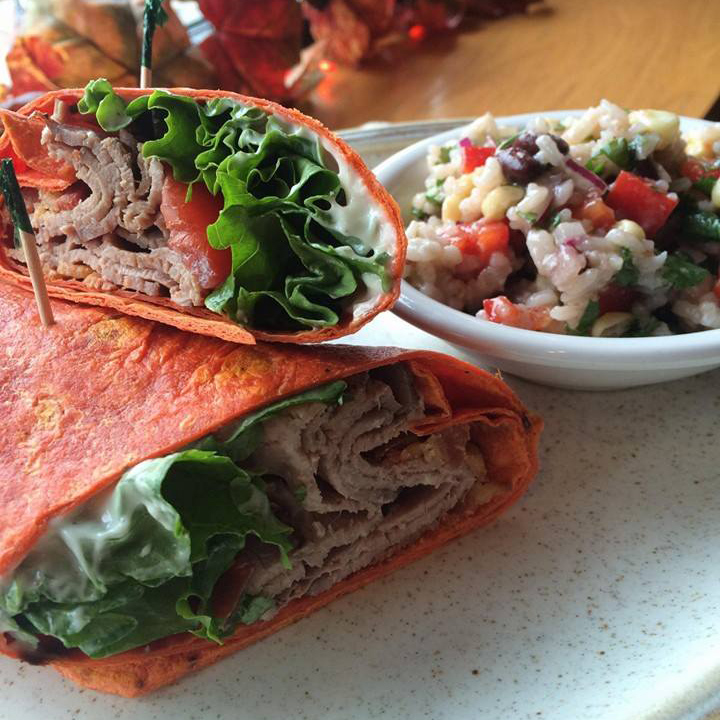
Locate an element on the screen. glass bowl is located at coordinates (587, 359).